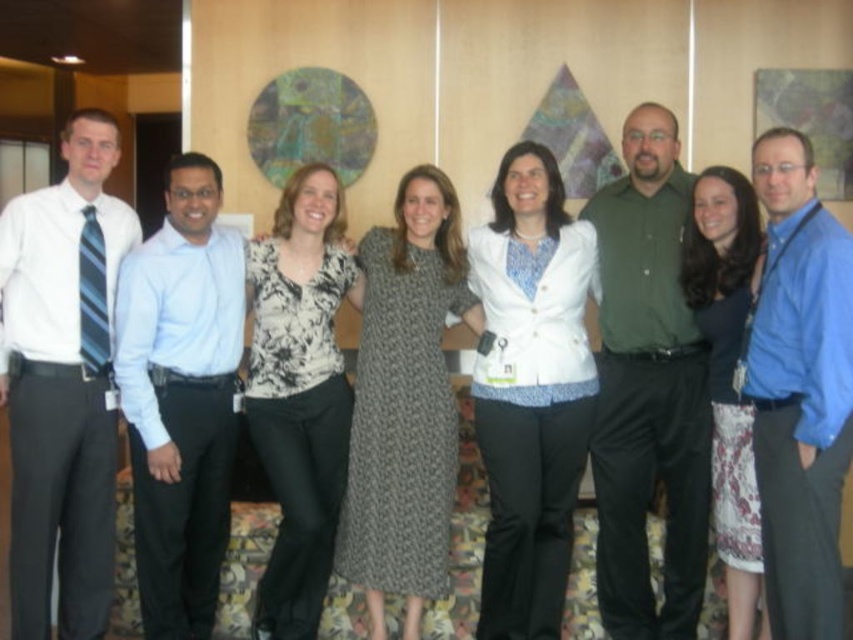
Is light blue shirt at center behind knit fabric dress at center?

No, light blue shirt at center is in front of knit fabric dress at center.

I want to click on light blue shirt at center, so click(181, 397).

Between point (158, 616) and point (364, 236), which one is positioned in front?

Positioned in front is point (158, 616).

The width and height of the screenshot is (853, 640). I want to click on light blue shirt at center, so click(x=181, y=397).

Between point (665, 125) and point (413, 419), which one is positioned behind?

The point (665, 125) is behind.

Does green cotton shirt at center have a greater height compared to knit fabric dress at center?

Correct, green cotton shirt at center is much taller as knit fabric dress at center.

Locate an element on the screen. This screenshot has height=640, width=853. green cotton shirt at center is located at coordinates pyautogui.click(x=648, y=388).

Which is above, light blue shirt at center or blue shirt at center?

blue shirt at center is above.

Does point (236, 282) come in front of point (772, 604)?

No, (236, 282) is further to viewer.

The image size is (853, 640). Identify the location of light blue shirt at center. (181, 397).